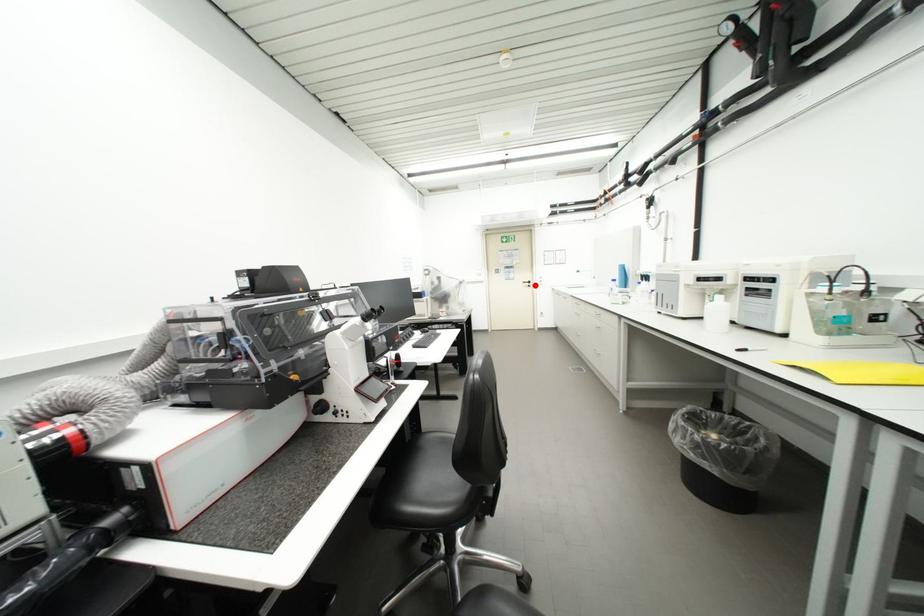
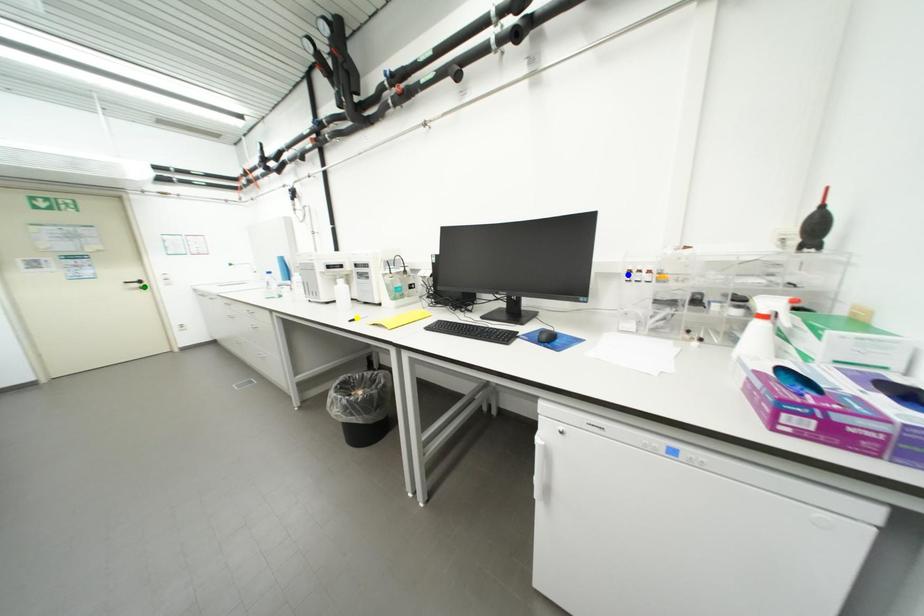
Question: I am providing you with two images of the same scene from different viewpoints. A red point is marked on the first image. You are given multiple points on the second image. Which spot in image 2 lines up with the point in image 1?

Choices:
 (A) yellow point
 (B) green point
 (C) blue point

Answer: (B)